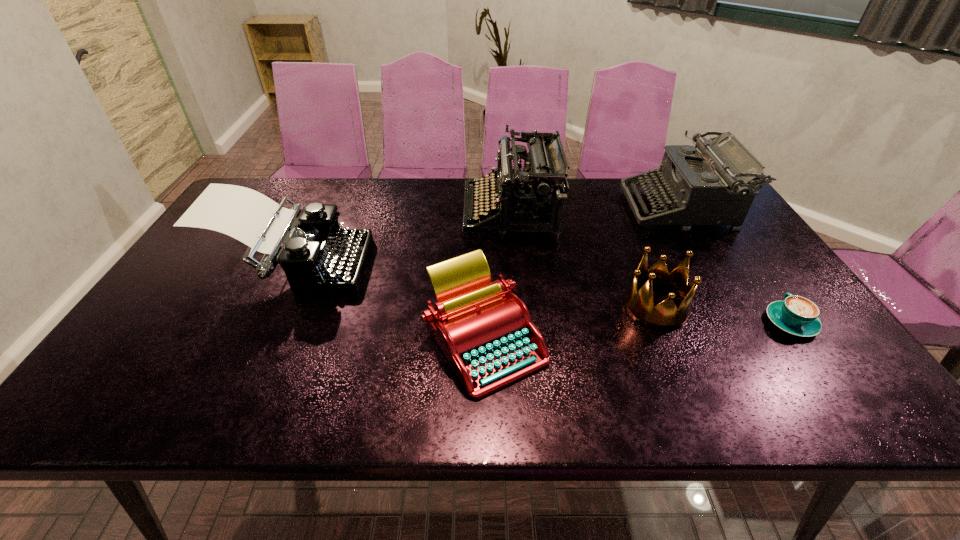
Locate an element on the screen. vacant region at the far left corner is located at coordinates (253, 179).

I want to click on empty space between the cappuccino and the leftmost typewriter, so (x=542, y=294).

Where is `free space between the cappuccino and the crown`? The image size is (960, 540). free space between the cappuccino and the crown is located at coordinates (723, 315).

You are a GUI agent. You are given a task and a screenshot of the screen. Output one action in this format:
    pyautogui.click(x=<x>, y=<y>)
    Task: Click on the free space between the shortest typewriter and the rightmost typewriter
    
    Given the screenshot: What is the action you would take?
    pyautogui.click(x=582, y=274)

This screenshot has width=960, height=540. What are the coordinates of `vacant point located between the shortest typewriter and the leftmost typewriter` in the screenshot? It's located at (390, 303).

Find the location of `vacant region between the rightmost typewriter and the leftmost object`. vacant region between the rightmost typewriter and the leftmost object is located at coordinates coord(487,237).

Identify the location of vacant space in between the rightmost typewriter and the leftmost typewriter. (487, 237).

Locate an element on the screen. free space between the rightmost typewriter and the shortest object is located at coordinates (735, 265).

The image size is (960, 540). In order to click on blank region between the shortest typewriter and the crown in this screenshot , I will do `click(570, 323)`.

At what (x,y) coordinates should I click in order to perform the action: click on object that is the second closest to the crown. Please return your answer as a coordinate pair (x, y). The height and width of the screenshot is (540, 960). Looking at the image, I should click on (709, 184).